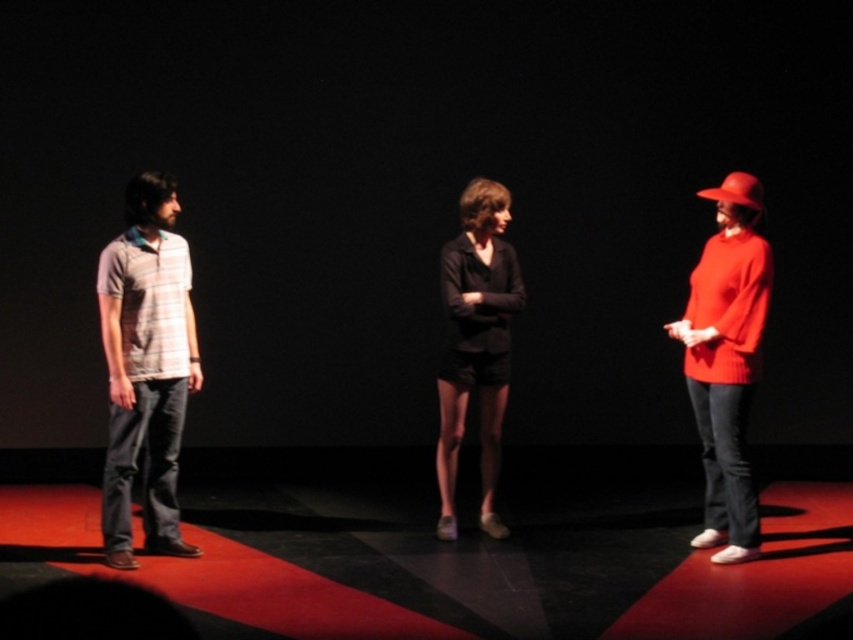
You are a photographer positioned at the center of the stage. You need to capture a photo where both the striped cotton polo shirt at left and the matte red sweater at right are in focus. Given that your camera has a depth of field that can cover 8 feet, will you be able to achieve this?

The striped cotton polo shirt at left is 8.12 feet away from the matte red sweater at right. Since the distance between them exceeds the camera lens depth of field of 8 feet, the photographer might struggle to keep both in focus simultaneously.

You are a photographer setting up a camera on the stage. You need to ensure that both the matte red sweater at right and the black matte shorts at center are fully visible in your shot. Given their sizes, which object should you adjust your focus to accommodate first?

The matte red sweater at right is larger in size compared to the black matte shorts at center, so you should adjust your focus to accommodate the matte red sweater at right first to ensure it fits within the frame.

You are standing in front of the stage. The stage has a red carpet on the left side and a black floor on the right. You see the striped cotton polo shirt at left. Can you walk from the black floor area to the red carpet area without stepping on the red carpet?

The striped cotton polo shirt at left is 12.98 feet away from you. Since the stage is divided into two sections, red carpet on the left and black floor on the right, you would need to move from the black floor towards the left to reach the red carpet. However, walking from the black floor area to the red carpet area would require stepping onto the red carpet itself, which is not possible without touching it. Therefore, you cannot walk from the black floor to the red carpet without stepping on the red carpet